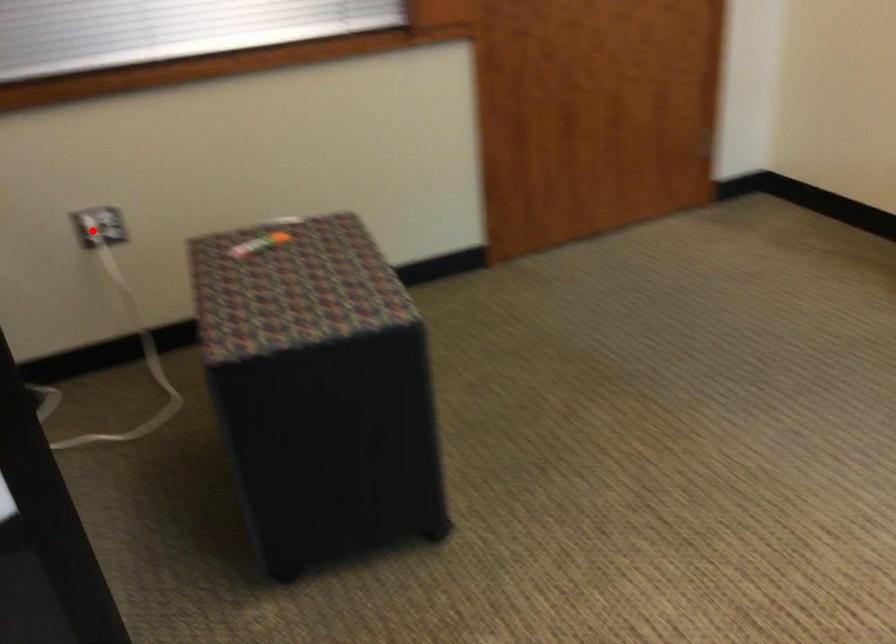
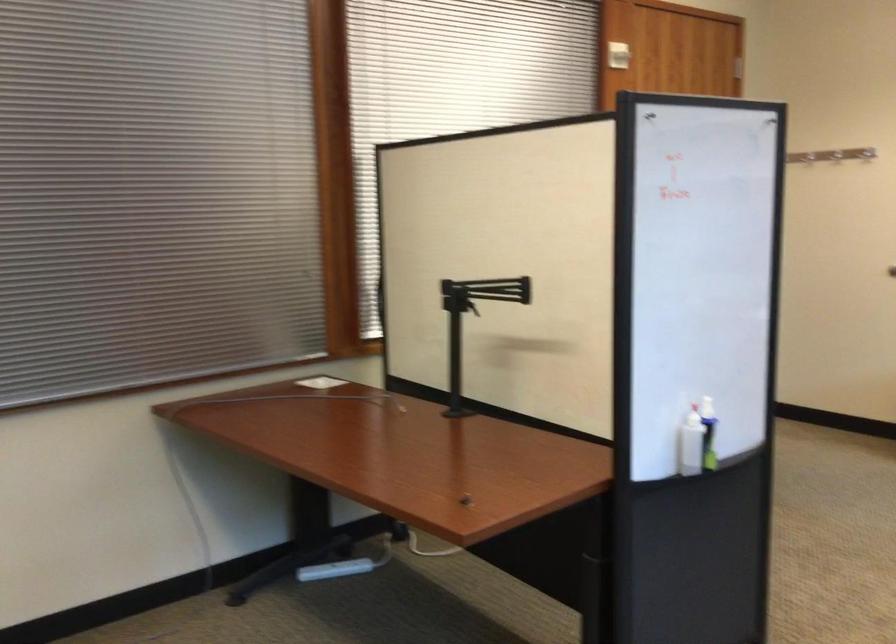
Question: I am providing you with two images of the same scene from different viewpoints. A red point is marked on the first image. At the location where the point appears in image 1, is it still visible in image 2?

Choices:
 (A) Yes
 (B) No

Answer: (B)